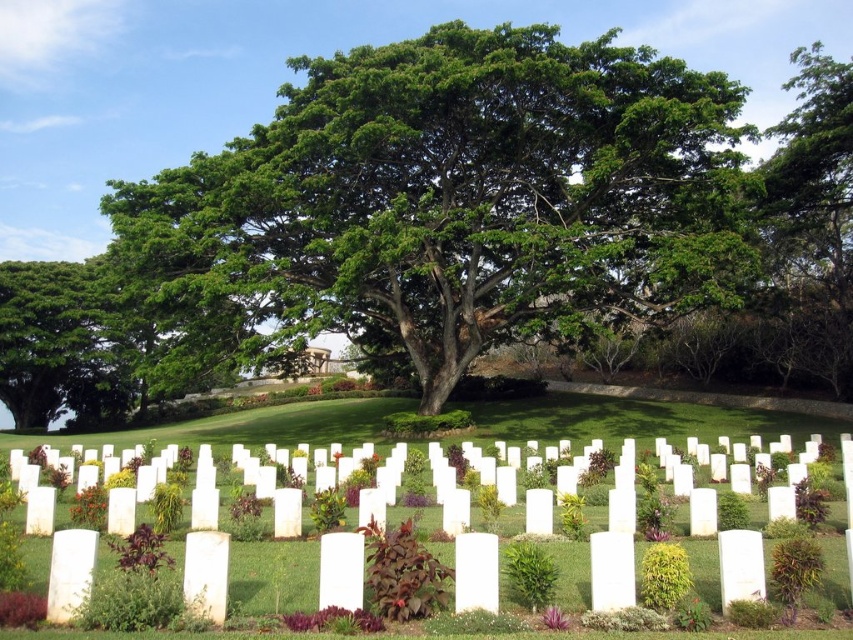
Question: Which point is closer to the camera?

Choices:
 (A) green leafy tree at center
 (B) white matte headstones at center

Answer: (B)

Question: Considering the relative positions of green leafy tree at center and white matte headstones at center in the image provided, where is green leafy tree at center located with respect to white matte headstones at center?

Choices:
 (A) above
 (B) below

Answer: (A)

Question: Does green leafy tree at center appear over white matte headstones at center?

Choices:
 (A) yes
 (B) no

Answer: (A)

Question: Does green leafy tree at center appear on the right side of white matte headstones at center?

Choices:
 (A) no
 (B) yes

Answer: (A)